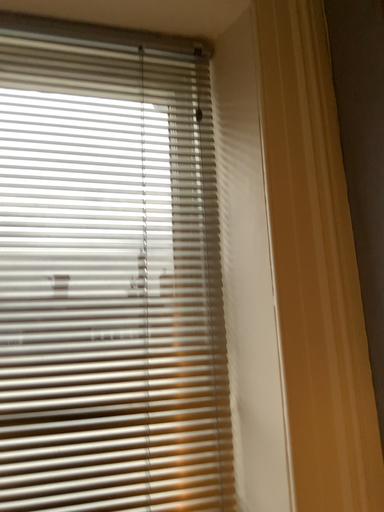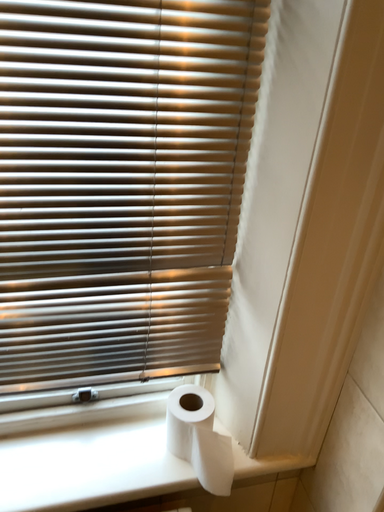
Question: Which way did the camera rotate in the video?

Choices:
 (A) rotated upward
 (B) rotated downward

Answer: (B)